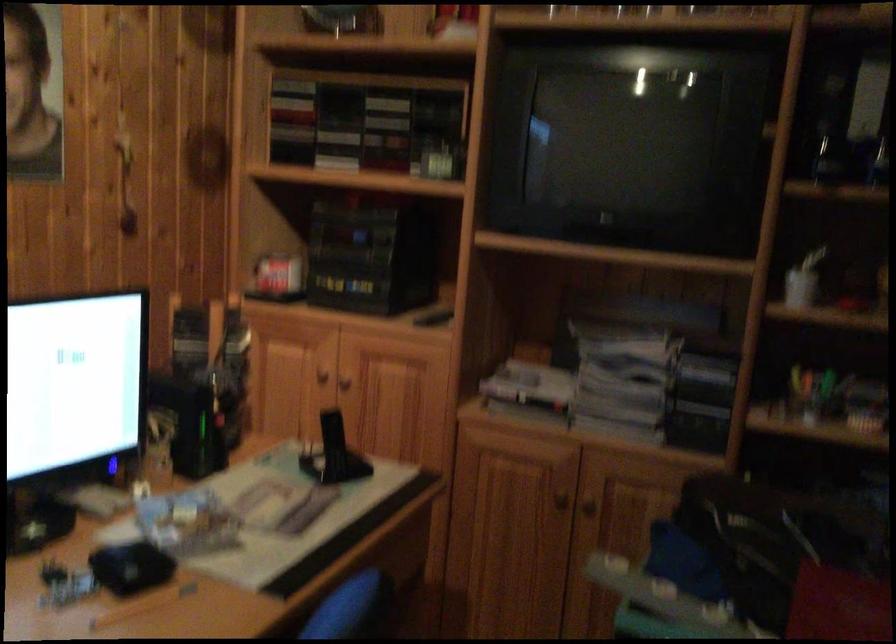
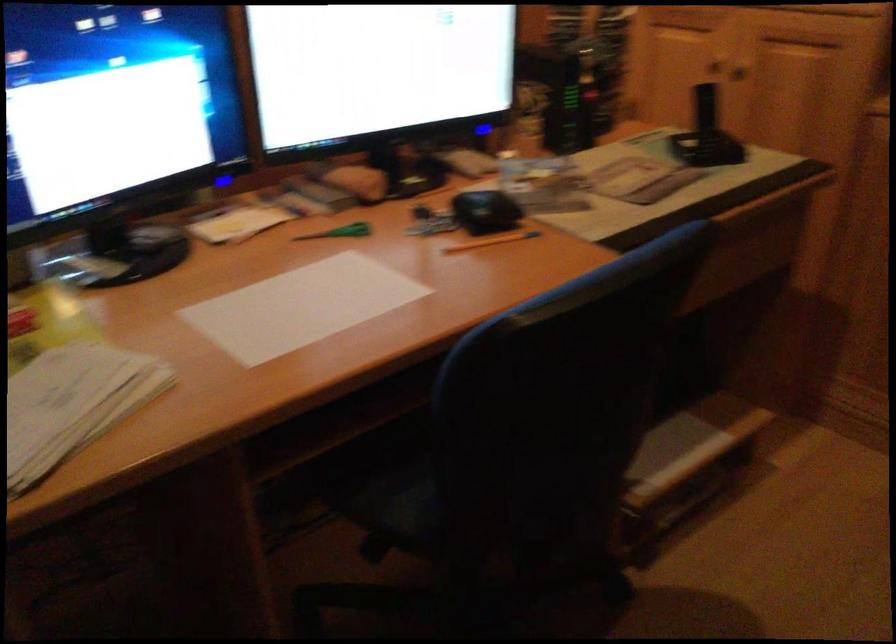
Find the pixel in the second image that matches (351,379) in the first image.

(734, 76)